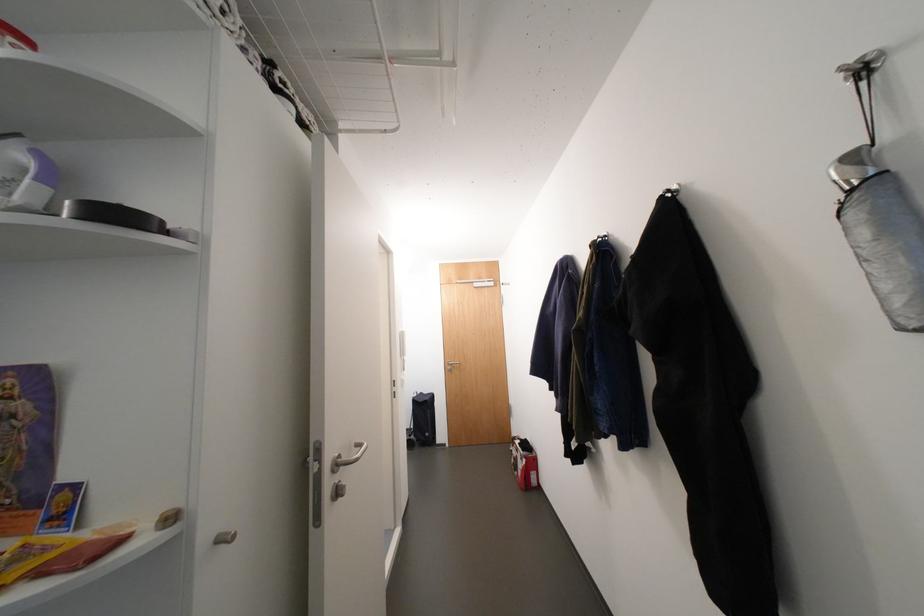
At what (x,y) coordinates should I click in order to perform the action: click on red box handle. Please return your answer as a coordinate pair (x, y). The image size is (924, 616). Looking at the image, I should click on (528, 477).